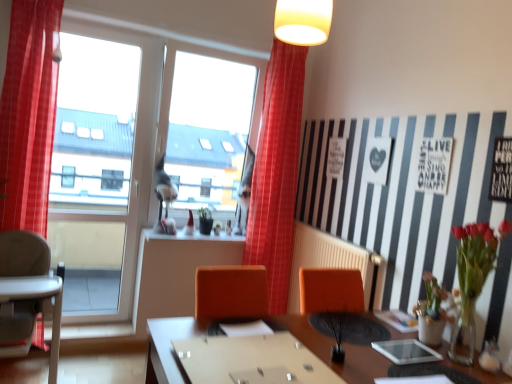
At what (x,y) coordinates should I click in order to perform the action: click on blank space situated above wooden table at center (from a real-world perspective). Please return your answer as a coordinate pair (x, y). Looking at the image, I should click on (328, 350).